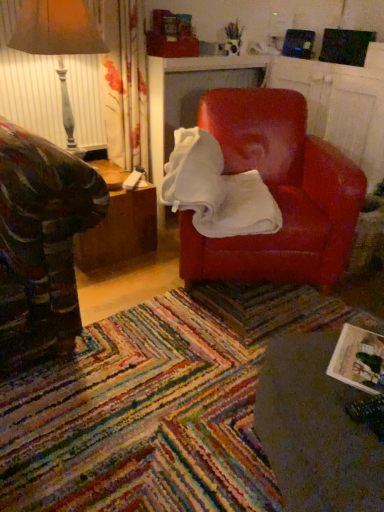
This screenshot has width=384, height=512. In order to click on free space above matte white magazine at lower right (from a real-world perspective) in this screenshot , I will do `click(367, 353)`.